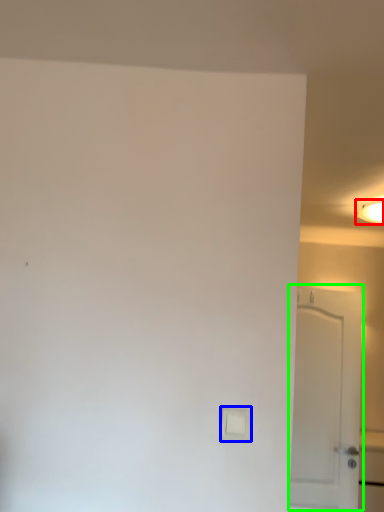
Question: Which object is the closest to the lighting (highlighted by a red box)? Choose among these: light switch (highlighted by a blue box) or door (highlighted by a green box).

Choices:
 (A) light switch
 (B) door

Answer: (B)